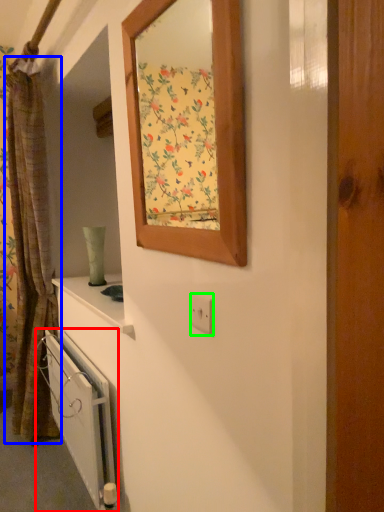
Question: Based on their relative distances, which object is farther from radiator (highlighted by a red box)? Choose from curtain (highlighted by a blue box) and electric outlet (highlighted by a green box).

Choices:
 (A) curtain
 (B) electric outlet

Answer: (B)